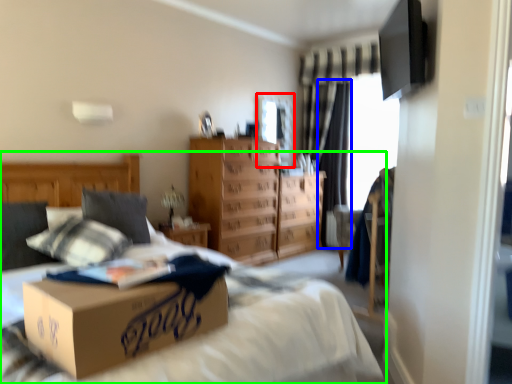
Question: Estimate the real-world distances between objects in this image. Which object is closer to window screen (highlighted by a red box), curtain (highlighted by a blue box) or bed (highlighted by a green box)?

Choices:
 (A) curtain
 (B) bed

Answer: (A)